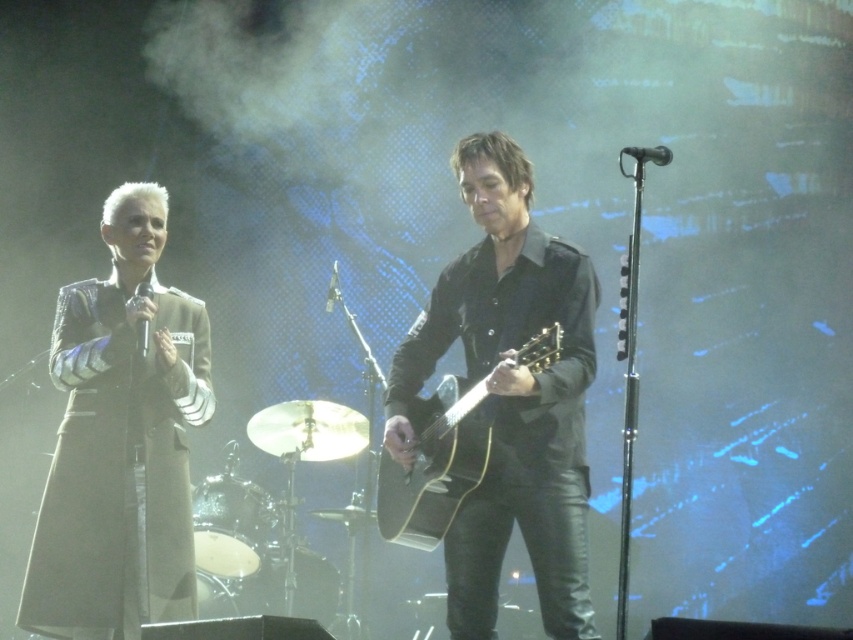
Question: Which point is closer to the camera?

Choices:
 (A) black matte microphone at upper center
 (B) black matte microphone at center

Answer: (A)

Question: Does matte black guitar at center have a greater width compared to black matte microphone at upper center?

Choices:
 (A) yes
 (B) no

Answer: (A)

Question: Which of these objects is positioned farthest from the smooth black drum at lower center?

Choices:
 (A) black glossy microphone at left
 (B) smooth silver drum at lower left
 (C) leather jacket at left
 (D) black leather guitar at center

Answer: (D)

Question: Which point is farther to the camera?

Choices:
 (A) (247, 580)
 (B) (137, 352)
 (C) (230, 544)
 (D) (334, 304)

Answer: (D)

Question: Does leather jacket at left have a larger size compared to black matte microphone at center?

Choices:
 (A) yes
 (B) no

Answer: (A)

Question: Is leather jacket at left below black matte microphone at center?

Choices:
 (A) no
 (B) yes

Answer: (B)